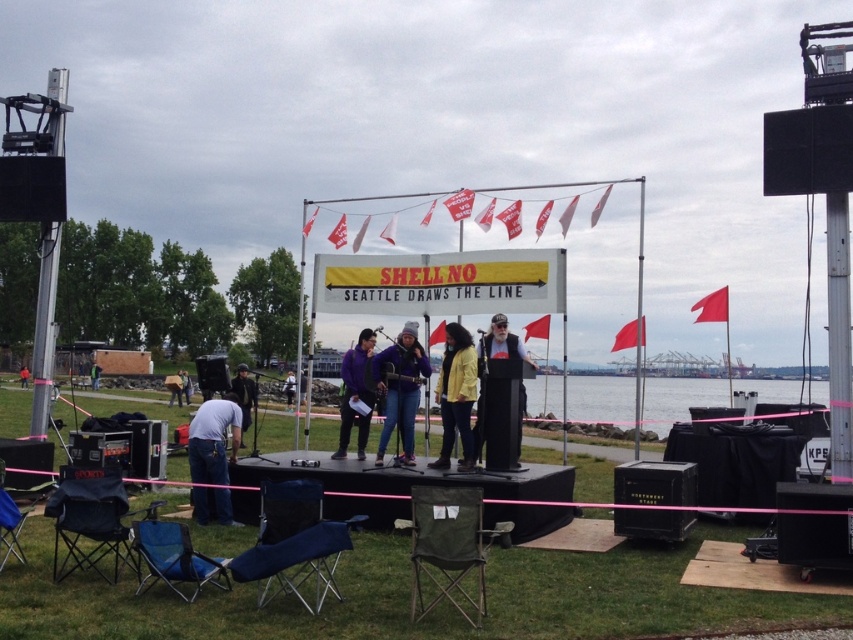
Question: Can you confirm if dark blue fabric chair at lower left is thinner than matte black vest at center?

Choices:
 (A) no
 (B) yes

Answer: (A)

Question: Estimate the real-world distances between objects in this image. Which object is closer to the green fabric chair at lower center?

Choices:
 (A) dark blue jeans at center
 (B) dark blue fabric chair at lower left
 (C) green fabric jacket at center

Answer: (B)

Question: Can you confirm if purple matte jacket at center is positioned below orange fabric at center?

Choices:
 (A) yes
 (B) no

Answer: (B)

Question: Among these objects, which one is farthest from the camera?

Choices:
 (A) matte black vest at center
 (B) dark blue jeans at lower left
 (C) transparent water at stage right

Answer: (C)

Question: Is purple matte jacket at center closer to the viewer compared to white cotton shirt at center?

Choices:
 (A) no
 (B) yes

Answer: (B)

Question: Which object is farther from the camera taking this photo?

Choices:
 (A) matte black vest at center
 (B) yellow matte jacket at center
 (C) green fabric chair at lower center
 (D) dark blue jeans at center

Answer: (D)